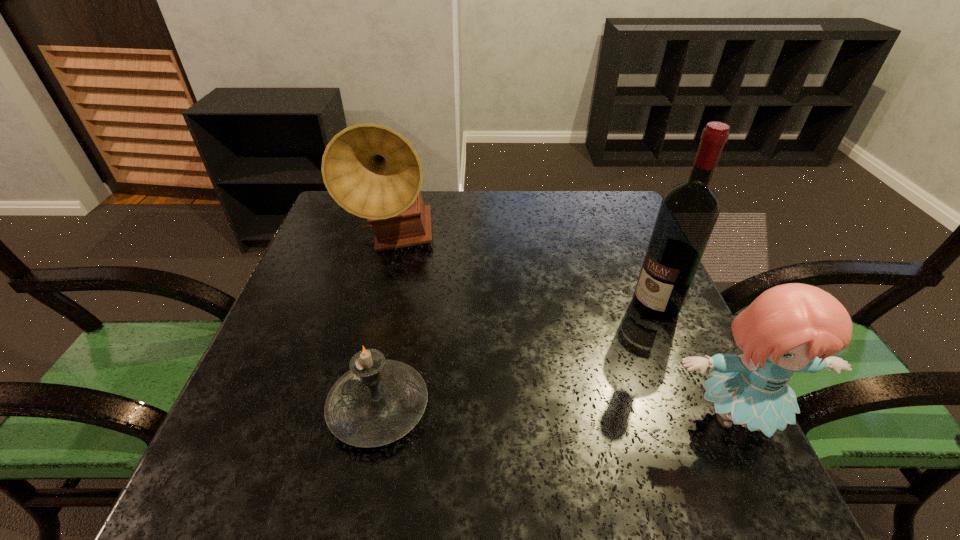
You are a GUI agent. You are given a task and a screenshot of the screen. Output one action in this format:
    pyautogui.click(x=<x>, y=<y>)
    Task: Click on the free space on the desktop that is between the candle and the doll and is positioned on the horn of the farthest object
    The height and width of the screenshot is (540, 960).
    Given the screenshot: What is the action you would take?
    pyautogui.click(x=554, y=413)

Locate an element on the screen. The height and width of the screenshot is (540, 960). vacant spot on the desktop that is between the candle and the third tallest object and is positioned on the front and back of the alcohol is located at coordinates (516, 411).